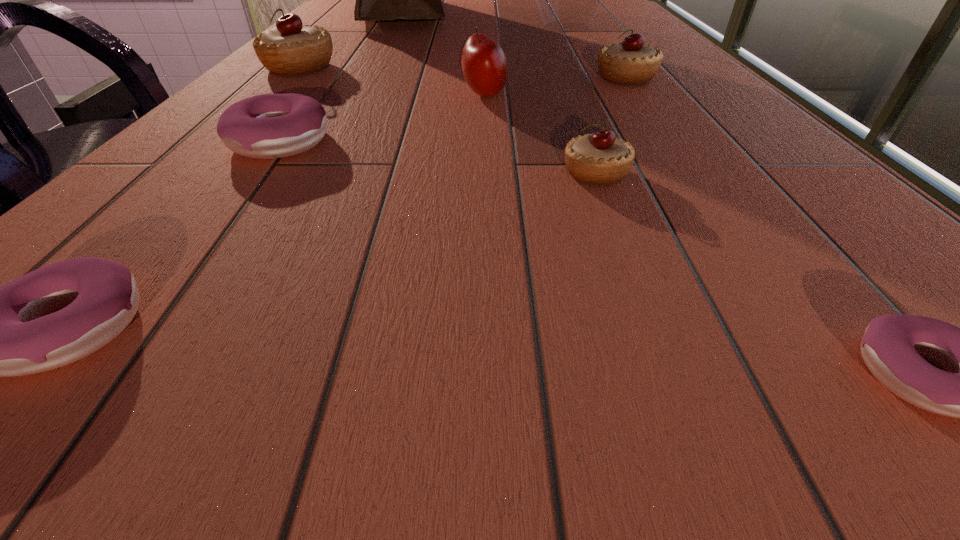
Locate an element on the screen. the tallest object is located at coordinates (376, 0).

Image resolution: width=960 pixels, height=540 pixels. I want to click on lampshade, so [x=568, y=0].

Where is `the second tallest object`? the second tallest object is located at coordinates (568, 0).

Identify the location of the tallest pastry. (290, 48).

I want to click on the leftmost beige pastry, so click(290, 48).

The image size is (960, 540). Find the location of `apple`. apple is located at coordinates (484, 65).

Identify the location of the fifth shortest object. The height and width of the screenshot is (540, 960). (630, 62).

This screenshot has height=540, width=960. In order to click on the second biggest beige pastry in this screenshot , I will do `click(630, 62)`.

Where is `the sixth tallest object`? the sixth tallest object is located at coordinates (600, 158).

The width and height of the screenshot is (960, 540). Find the location of `the fourth pastry from left to right`. the fourth pastry from left to right is located at coordinates (600, 158).